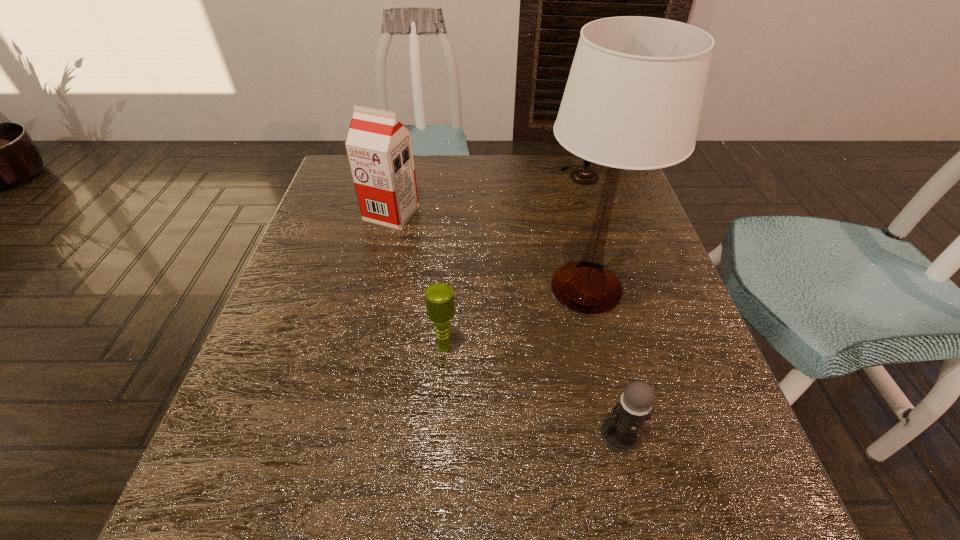
The width and height of the screenshot is (960, 540). Identify the location of the tallest object. (633, 99).

Where is `the third farthest object`? the third farthest object is located at coordinates (633, 99).

This screenshot has height=540, width=960. I want to click on soya milk, so click(379, 147).

Identify the location of the second tallest object. (379, 147).

This screenshot has height=540, width=960. What are the coordinates of `the farthest object` in the screenshot? It's located at 584,176.

This screenshot has width=960, height=540. Identify the location of the tallest microphone. (584, 176).

What are the coordinates of `the second farthest microphone` in the screenshot? It's located at (439, 297).

Image resolution: width=960 pixels, height=540 pixels. Find the location of `the second object from left to right`. the second object from left to right is located at coordinates (439, 297).

I want to click on the nearest object, so click(619, 431).

Identify the location of vacant point located above the cylindrical shade of the tallest object. The width and height of the screenshot is (960, 540). (428, 287).